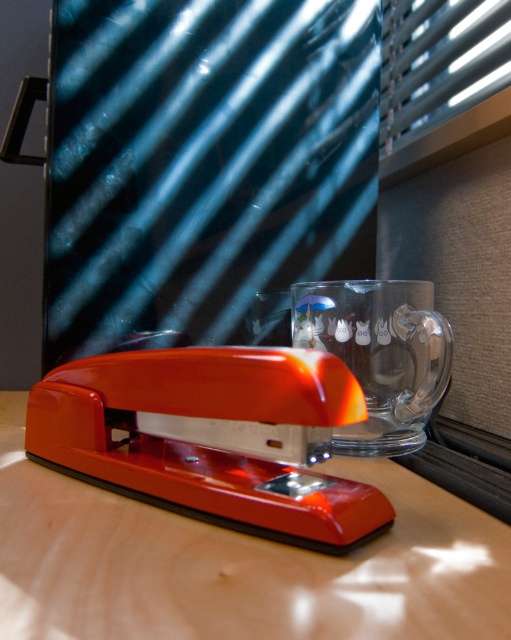
Question: Is glossy plastic stapler at center to the left of metallic blinds at upper right from the viewer's perspective?

Choices:
 (A) no
 (B) yes

Answer: (B)

Question: Which of these objects is positioned farthest from the glossy plastic stapler at center?

Choices:
 (A) transparent glass at center
 (B) metallic blinds at upper right

Answer: (B)

Question: Can you confirm if glossy wood stapler at lower left is bigger than metallic blinds at upper right?

Choices:
 (A) yes
 (B) no

Answer: (B)

Question: Among these points, which one is nearest to the camera?

Choices:
 (A) (398, 388)
 (B) (443, 109)
 (C) (326, 500)
 (D) (114, 593)

Answer: (D)

Question: Which of these objects is positioned closest to the glossy plastic stapler at center?

Choices:
 (A) transparent glass at center
 (B) metallic blinds at upper right
 (C) glossy wood stapler at lower left

Answer: (C)

Question: Does transparent glass at center appear under metallic blinds at upper right?

Choices:
 (A) no
 (B) yes

Answer: (B)